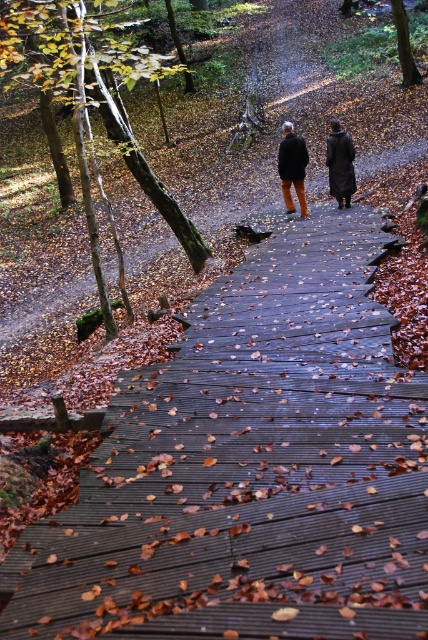
Question: Among these points, which one is farthest from the camera?

Choices:
 (A) (308, 161)
 (B) (344, 157)

Answer: (A)

Question: Where is dark brown leather coat at center located in relation to matte black jacket at center in the image?

Choices:
 (A) left
 (B) right

Answer: (B)

Question: Which object appears farthest from the camera in this image?

Choices:
 (A) dark brown leather coat at upper right
 (B) dark brown leather coat at center
 (C) matte black jacket at center

Answer: (C)

Question: Is dark brown leather coat at center to the left of dark brown leather coat at upper right from the viewer's perspective?

Choices:
 (A) yes
 (B) no

Answer: (A)

Question: Considering the relative positions of dark brown leather coat at center and matte black jacket at center in the image provided, where is dark brown leather coat at center located with respect to matte black jacket at center?

Choices:
 (A) left
 (B) right

Answer: (B)

Question: Based on their relative distances, which object is farther from the dark brown leather coat at upper right?

Choices:
 (A) dark brown leather coat at center
 (B) matte black jacket at center

Answer: (B)